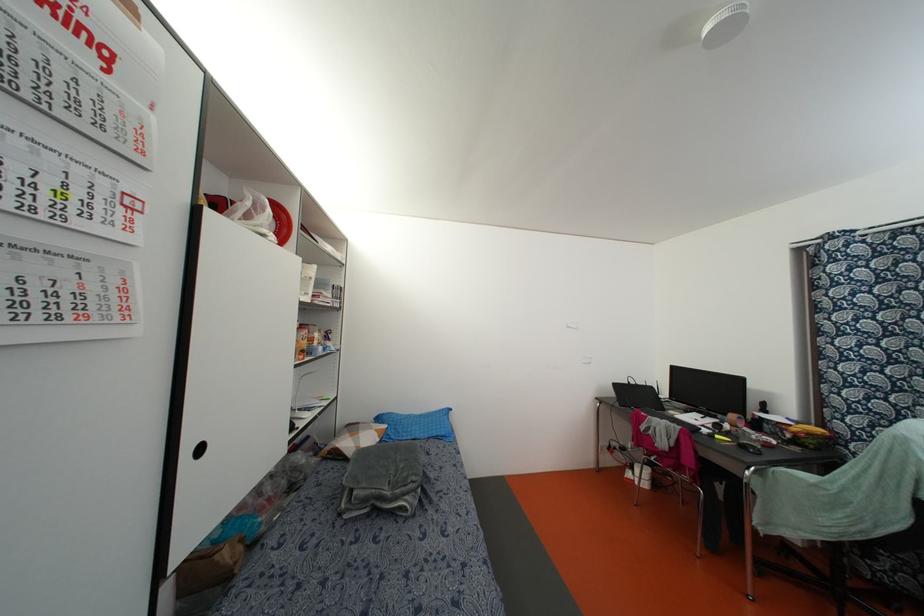
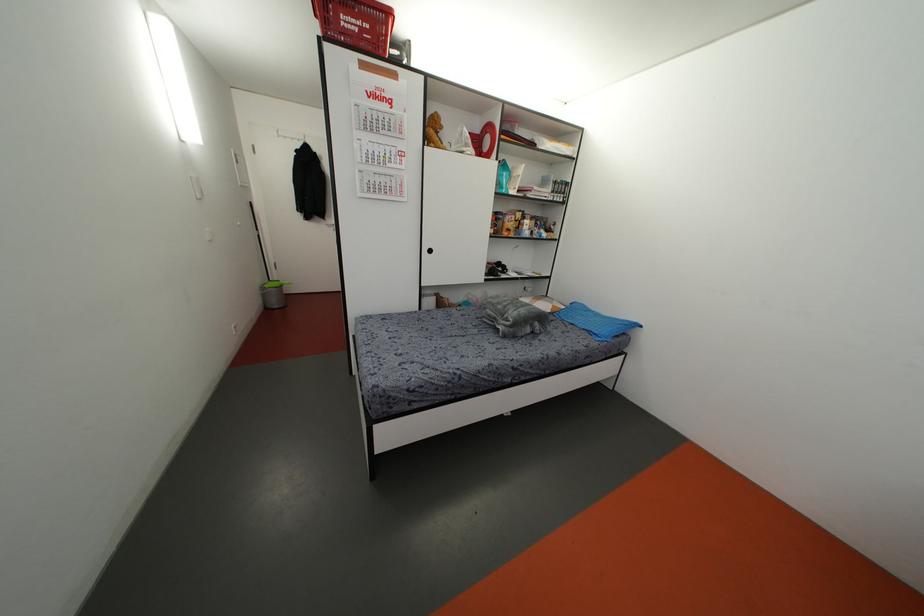
The point at (442, 434) is marked in the first image. Where is the corresponding point in the second image?

(596, 331)